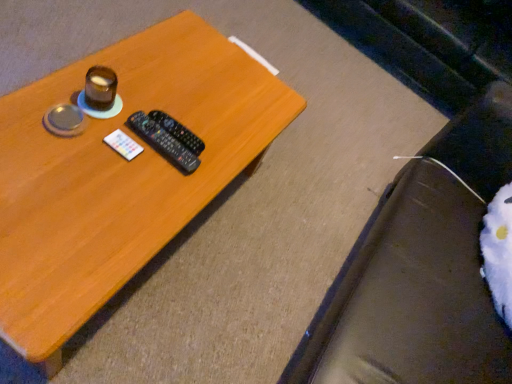
Question: From a real-world perspective, is wooden table at center physically located above or below white fuzzy bean bag chair at lower right?

Choices:
 (A) above
 (B) below

Answer: (B)

Question: From the image's perspective, is wooden table at center positioned above or below white fuzzy bean bag chair at lower right?

Choices:
 (A) above
 (B) below

Answer: (A)

Question: Estimate the real-world distances between objects in this image. Which object is farther from the wooden table at center?

Choices:
 (A) black plastic remote at center, placed as the second remote control when sorted from back to front
 (B) black plastic remote control at center, placed as the second remote control when sorted from front to back
 (C) shiny brown cup at upper left
 (D) white fuzzy bean bag chair at lower right

Answer: (D)

Question: Based on their relative distances, which object is nearer to the white fuzzy bean bag chair at lower right?

Choices:
 (A) black plastic remote at center, placed as the second remote control when sorted from back to front
 (B) black plastic remote control at center, the 1th remote control viewed from the back
 (C) shiny brown cup at upper left
 (D) wooden table at center

Answer: (D)